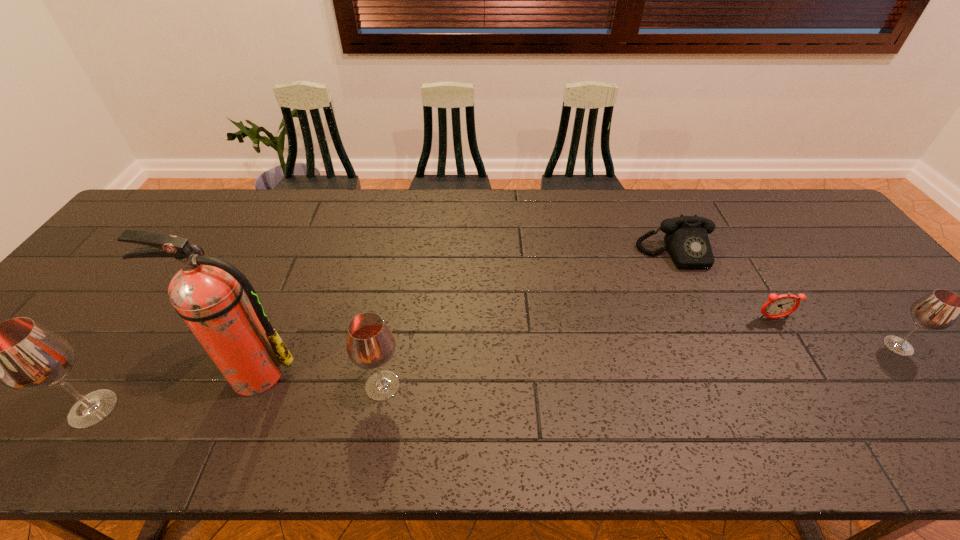
Identify the location of free space that satisfies the following two spatial constraints: 1. on the dial of the rightmost wineglass; 2. on the right side of the farthest object. This screenshot has width=960, height=540. (718, 346).